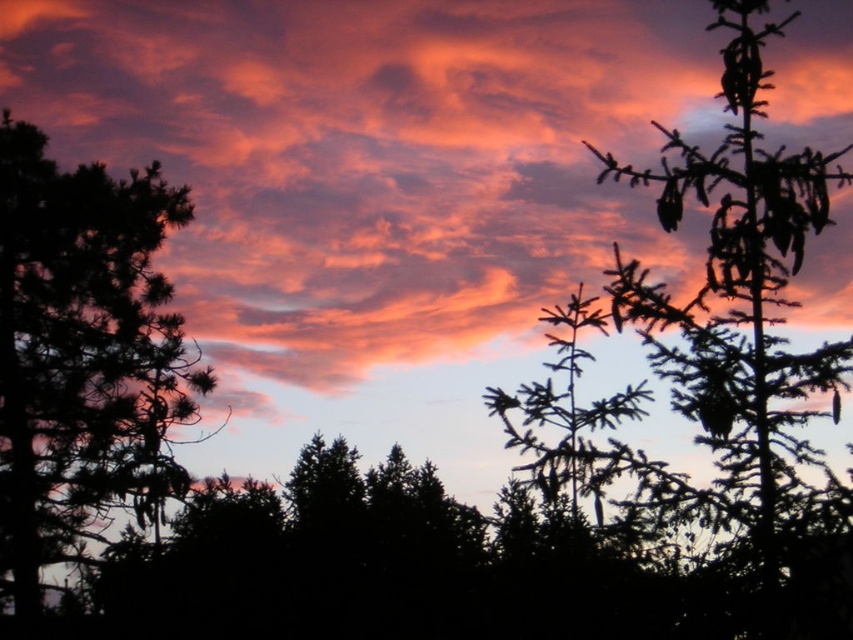
In the scene shown: Does orange cotton cloud at upper center appear over silhouette tree at left?

Yes, orange cotton cloud at upper center is above silhouette tree at left.

Which of these two, orange cotton cloud at upper center or silhouette tree at left, stands shorter?

orange cotton cloud at upper center is shorter.

What do you see at coordinates (374, 161) in the screenshot? I see `orange cotton cloud at upper center` at bounding box center [374, 161].

What are the coordinates of `orange cotton cloud at upper center` in the screenshot? It's located at (374, 161).

Does orange cotton cloud at upper center come in front of silhouette pine at right?

No, orange cotton cloud at upper center is further to the viewer.

Is point (398, 196) less distant than point (785, 268)?

That is False.

Where is `orange cotton cloud at upper center`? The image size is (853, 640). orange cotton cloud at upper center is located at coordinates (374, 161).

Who is higher up, silhouette tree at left or silhouette pine at right?

silhouette pine at right is above.

How distant is silhouette tree at left from silhouette pine at right?

The distance of silhouette tree at left from silhouette pine at right is 16.11 feet.

Is point (112, 412) closer to viewer compared to point (851, 355)?

No, (112, 412) is further to viewer.

Find the location of a particular element. silhouette tree at left is located at coordinates (83, 356).